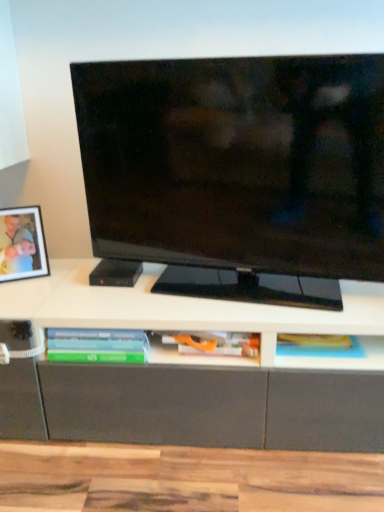
Question: Is matte orange book at center, the second book when ordered from left to right, thinner than matte black picture frame at left?

Choices:
 (A) no
 (B) yes

Answer: (A)

Question: Is matte orange book at center, the 1th book in the right-to-left sequence, smaller than matte black picture frame at left?

Choices:
 (A) yes
 (B) no

Answer: (A)

Question: From the image's perspective, is matte orange book at center, the second book when ordered from left to right, on matte black picture frame at left?

Choices:
 (A) no
 (B) yes

Answer: (A)

Question: From a real-world perspective, is matte orange book at center, the second book when ordered from left to right, physically above matte black picture frame at left?

Choices:
 (A) no
 (B) yes

Answer: (A)

Question: Is matte orange book at center, the 1th book in the right-to-left sequence, taller than matte black picture frame at left?

Choices:
 (A) yes
 (B) no

Answer: (B)

Question: From their relative heights in the image, would you say matte black picture frame at left is taller or shorter than translucent plastic book at lower center, arranged as the first book when viewed from the left?

Choices:
 (A) short
 (B) tall

Answer: (B)

Question: Considering the positions of matte black picture frame at left and translucent plastic book at lower center, arranged as the first book when viewed from the left, in the image, is matte black picture frame at left bigger or smaller than translucent plastic book at lower center, arranged as the first book when viewed from the left,?

Choices:
 (A) small
 (B) big

Answer: (B)

Question: Looking at their shapes, would you say matte black picture frame at left is wider or thinner than translucent plastic book at lower center, arranged as the first book when viewed from the left?

Choices:
 (A) thin
 (B) wide

Answer: (A)

Question: Visually, is matte black picture frame at left positioned to the left or to the right of translucent plastic book at lower center, arranged as the first book when viewed from the left?

Choices:
 (A) left
 (B) right

Answer: (A)

Question: From a real-world perspective, is translucent plastic book at lower center, the 2th book viewed from the right, positioned above or below matte orange book at center, the second book when ordered from left to right?

Choices:
 (A) below
 (B) above

Answer: (B)

Question: Is point (145, 339) positioned closer to the camera than point (188, 360)?

Choices:
 (A) farther
 (B) closer

Answer: (A)

Question: Which is correct: translucent plastic book at lower center, the 2th book viewed from the right, is inside matte orange book at center, the second book when ordered from left to right, or outside of it?

Choices:
 (A) outside
 (B) inside

Answer: (A)

Question: From the image's perspective, is translucent plastic book at lower center, arranged as the first book when viewed from the left, located above or below matte orange book at center, the second book when ordered from left to right?

Choices:
 (A) below
 (B) above

Answer: (B)

Question: From the image's perspective, relative to matte orange book at center, the second book when ordered from left to right, is matte black picture frame at left above or below?

Choices:
 (A) below
 (B) above

Answer: (B)

Question: Which is correct: matte black picture frame at left is inside matte orange book at center, the 1th book in the right-to-left sequence, or outside of it?

Choices:
 (A) outside
 (B) inside

Answer: (A)